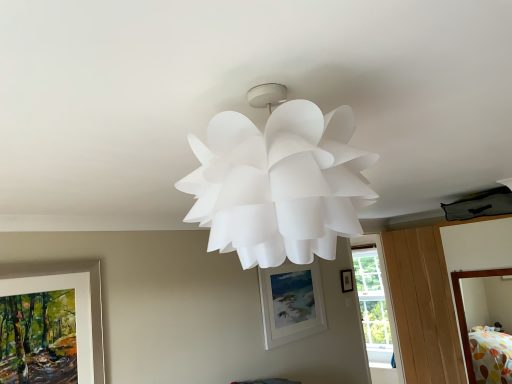
Question: Could you tell me if matte black picture frame at upper center, which is the 1th picture frame in right-to-left order, is turned towards transparent glass window at center?

Choices:
 (A) no
 (B) yes

Answer: (A)

Question: From a real-world perspective, is matte black picture frame at upper center, which appears as the first picture frame when viewed from the back, located beneath transparent glass window at center?

Choices:
 (A) no
 (B) yes

Answer: (A)

Question: Is matte black picture frame at upper center, positioned as the 3th picture frame in left-to-right order, touching transparent glass window at center?

Choices:
 (A) yes
 (B) no

Answer: (B)

Question: Is matte black picture frame at upper center, which appears as the first picture frame when viewed from the back, positioned beyond the bounds of transparent glass window at center?

Choices:
 (A) yes
 (B) no

Answer: (A)

Question: Is matte black picture frame at upper center, positioned as the 3th picture frame in left-to-right order, far from transparent glass window at center?

Choices:
 (A) no
 (B) yes

Answer: (B)

Question: From the image's perspective, is matte white picture frame at left, which is the 1th picture frame in front-to-back order, positioned above or below white matte picture frame at center, which appears as the 2th picture frame when viewed from the back?

Choices:
 (A) below
 (B) above

Answer: (B)

Question: Does point (74, 279) appear closer or farther from the camera than point (297, 336)?

Choices:
 (A) farther
 (B) closer

Answer: (B)

Question: Would you say matte white picture frame at left, which ranks as the third picture frame in right-to-left order, is inside or outside white matte picture frame at center, arranged as the 2th picture frame when viewed from the right?

Choices:
 (A) outside
 (B) inside

Answer: (A)

Question: From a real-world perspective, is matte white picture frame at left, which is the 1th picture frame in front-to-back order, above or below white matte picture frame at center, arranged as the 2th picture frame when viewed from the right?

Choices:
 (A) above
 (B) below

Answer: (A)

Question: From the image's perspective, relative to transparent glass window at center, is matte black picture frame at upper center, the 3th picture frame viewed from the front, above or below?

Choices:
 (A) above
 (B) below

Answer: (A)

Question: Considering the positions of matte black picture frame at upper center, positioned as the 3th picture frame in left-to-right order, and transparent glass window at center in the image, is matte black picture frame at upper center, positioned as the 3th picture frame in left-to-right order, bigger or smaller than transparent glass window at center?

Choices:
 (A) small
 (B) big

Answer: (A)

Question: Is point (349, 283) closer or farther from the camera than point (373, 342)?

Choices:
 (A) farther
 (B) closer

Answer: (B)

Question: Visually, is matte black picture frame at upper center, positioned as the 3th picture frame in left-to-right order, positioned to the left or to the right of transparent glass window at center?

Choices:
 (A) left
 (B) right

Answer: (A)

Question: Considering the positions of point (40, 261) and point (364, 327), is point (40, 261) closer or farther from the camera than point (364, 327)?

Choices:
 (A) closer
 (B) farther

Answer: (A)

Question: Would you say matte white picture frame at left, which ranks as the third picture frame in right-to-left order, is inside or outside transparent glass window at center?

Choices:
 (A) inside
 (B) outside

Answer: (B)